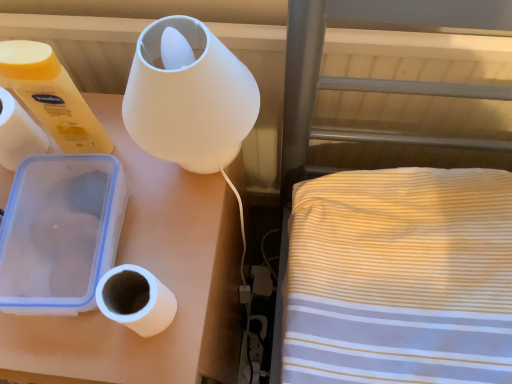
Image resolution: width=512 pixels, height=384 pixels. I want to click on white matte toilet paper at left, the first toilet paper from the left, so click(x=52, y=96).

This screenshot has width=512, height=384. What do you see at coordinates (136, 300) in the screenshot? I see `white matte toilet paper at lower left, positioned as the first toilet paper in right-to-left order` at bounding box center [136, 300].

Measure the distance between white matte lamp at upper left and camera.

The distance of white matte lamp at upper left from camera is 50.38 centimeters.

I want to click on white matte lamp at upper left, so click(156, 275).

The image size is (512, 384). What are the coordinates of `white matte paper towel at left` in the screenshot? It's located at (18, 133).

In order to click on frosted glass lamp at upper center in this screenshot , I will do `click(190, 100)`.

Where is `lamp lying above the white matte paper towel at left (from the image's perspective)`? lamp lying above the white matte paper towel at left (from the image's perspective) is located at coordinates (190, 100).

Is white matte paper towel at left thinner than frosted glass lamp at upper center?

Correct, the width of white matte paper towel at left is less than that of frosted glass lamp at upper center.

How different are the orientations of white matte paper towel at left and frosted glass lamp at upper center in degrees?

They differ by 0.00862 degrees in their facing directions.

From the image's perspective, would you say white matte paper towel at left is shown under frosted glass lamp at upper center?

Yes, from the image's perspective, white matte paper towel at left is beneath frosted glass lamp at upper center.

Does white matte toilet paper at left, which is the second toilet paper from bottom to top, come behind white matte paper towel at left?

That is False.

From the image's perspective, would you say white matte toilet paper at left, the first toilet paper from the left, is shown under white matte paper towel at left?

No, from the image's perspective, white matte toilet paper at left, the first toilet paper from the left, is not below white matte paper towel at left.

Between white matte toilet paper at left, the first toilet paper from the left, and white matte paper towel at left, which one appears on the right side from the viewer's perspective?

white matte toilet paper at left, the first toilet paper from the left, is more to the right.

Between white matte toilet paper at left, the first toilet paper from the left, and white matte paper towel at left, which one has smaller size?

white matte paper towel at left is smaller.

How different are the orientations of white matte toilet paper at left, which is the second toilet paper from bottom to top, and white matte toilet paper at lower left, which is counted as the 2th toilet paper, starting from the left, in degrees?

0.00336 degrees.

Is white matte toilet paper at left, which is the second toilet paper from bottom to top, next to white matte toilet paper at lower left, the first toilet paper ordered from the bottom?

No, white matte toilet paper at left, which is the second toilet paper from bottom to top, is not beside white matte toilet paper at lower left, the first toilet paper ordered from the bottom.

Does white matte toilet paper at left, positioned as the first toilet paper in top-to-bottom order, appear on the right side of white matte toilet paper at lower left, the first toilet paper ordered from the bottom?

In fact, white matte toilet paper at left, positioned as the first toilet paper in top-to-bottom order, is to the left of white matte toilet paper at lower left, the first toilet paper ordered from the bottom.

Consider the image. Is white matte toilet paper at left, the first toilet paper from the left, thinner than white matte toilet paper at lower left, which is counted as the 2th toilet paper, starting from the left?

No, white matte toilet paper at left, the first toilet paper from the left, is not thinner than white matte toilet paper at lower left, which is counted as the 2th toilet paper, starting from the left.

Where is `toilet paper below the white matte paper towel at left (from a real-world perspective)`? toilet paper below the white matte paper towel at left (from a real-world perspective) is located at coordinates (136, 300).

Based on the photo, does white matte toilet paper at lower left, the second toilet paper viewed from the top, have a smaller size compared to white matte paper towel at left?

Yes.

Considering the relative positions of white matte toilet paper at lower left, which is counted as the 2th toilet paper, starting from the left, and white matte paper towel at left in the image provided, is white matte toilet paper at lower left, which is counted as the 2th toilet paper, starting from the left, to the right of white matte paper towel at left from the viewer's perspective?

Indeed, white matte toilet paper at lower left, which is counted as the 2th toilet paper, starting from the left, is positioned on the right side of white matte paper towel at left.

Considering the points (131, 265) and (35, 125), which point is behind, point (131, 265) or point (35, 125)?

The point (35, 125) is more distant.

Does frosted glass lamp at upper center turn towards white matte toilet paper at lower left, positioned as the first toilet paper in right-to-left order?

Yes, frosted glass lamp at upper center is facing white matte toilet paper at lower left, positioned as the first toilet paper in right-to-left order.

Can you tell me how much frosted glass lamp at upper center and white matte toilet paper at lower left, positioned as the first toilet paper in right-to-left order, differ in facing direction?

The angular difference between frosted glass lamp at upper center and white matte toilet paper at lower left, positioned as the first toilet paper in right-to-left order, is 0.00555 degrees.

In terms of width, does frosted glass lamp at upper center look wider or thinner when compared to white matte toilet paper at lower left, which is counted as the 2th toilet paper, starting from the left?

frosted glass lamp at upper center is wider than white matte toilet paper at lower left, which is counted as the 2th toilet paper, starting from the left.

Which is in front, point (155, 143) or point (164, 290)?

Positioned in front is point (155, 143).

Is white matte paper towel at left facing away from white matte lamp at upper left?

No, white matte paper towel at left's orientation is not away from white matte lamp at upper left.

Based on the photo, which is further, (8,118) or (208,360)?

Positioned behind is point (208,360).

The height and width of the screenshot is (384, 512). In order to click on paper towel above the white matte lamp at upper left (from a real-world perspective) in this screenshot , I will do `click(18, 133)`.

Measure the distance between white matte toilet paper at lower left, the second toilet paper viewed from the top, and white matte lamp at upper left.

The distance of white matte toilet paper at lower left, the second toilet paper viewed from the top, from white matte lamp at upper left is 5.49 inches.

Are white matte toilet paper at lower left, the second toilet paper viewed from the top, and white matte lamp at upper left far apart?

They are positioned close to each other.

Looking at this image, based on their sizes in the image, would you say white matte toilet paper at lower left, positioned as the first toilet paper in right-to-left order, is bigger or smaller than white matte lamp at upper left?

Clearly, white matte toilet paper at lower left, positioned as the first toilet paper in right-to-left order, is smaller in size than white matte lamp at upper left.

Which of these two, white matte toilet paper at lower left, which is counted as the 2th toilet paper, starting from the left, or white matte lamp at upper left, is thinner?

With smaller width is white matte toilet paper at lower left, which is counted as the 2th toilet paper, starting from the left.

Find the location of `paper towel that appears below the frosted glass lamp at upper center (from a real-world perspective)`. paper towel that appears below the frosted glass lamp at upper center (from a real-world perspective) is located at coordinates (18, 133).

Where is `paper towel on the left side of white matte toilet paper at left, positioned as the first toilet paper in top-to-bottom order`? This screenshot has height=384, width=512. paper towel on the left side of white matte toilet paper at left, positioned as the first toilet paper in top-to-bottom order is located at coordinates (18, 133).

In the scene shown: Looking at the image, which one is located closer to white matte paper towel at left, white matte toilet paper at left, positioned as the 2th toilet paper in right-to-left order, or frosted glass lamp at upper center?

The object closer to white matte paper towel at left is white matte toilet paper at left, positioned as the 2th toilet paper in right-to-left order.

Looking at this image, considering their positions, is frosted glass lamp at upper center positioned closer to white matte lamp at upper left than white matte toilet paper at lower left, positioned as the first toilet paper in right-to-left order?

The object closer to white matte lamp at upper left is white matte toilet paper at lower left, positioned as the first toilet paper in right-to-left order.

Based on their spatial positions, is white matte toilet paper at lower left, the first toilet paper ordered from the bottom, or white matte paper towel at left further from white matte toilet paper at left, positioned as the 2th toilet paper in right-to-left order?

Based on the image, white matte toilet paper at lower left, the first toilet paper ordered from the bottom, appears to be further to white matte toilet paper at left, positioned as the 2th toilet paper in right-to-left order.

Based on their spatial positions, is white matte lamp at upper left or frosted glass lamp at upper center further from white matte toilet paper at lower left, the second toilet paper viewed from the top?

The object further to white matte toilet paper at lower left, the second toilet paper viewed from the top, is frosted glass lamp at upper center.

Estimate the real-world distances between objects in this image. Which object is further from white matte paper towel at left, frosted glass lamp at upper center or white matte lamp at upper left?

Among the two, frosted glass lamp at upper center is located further to white matte paper towel at left.

Looking at the image, which one is located closer to white matte toilet paper at left, the first toilet paper from the left, white matte paper towel at left or frosted glass lamp at upper center?

white matte paper towel at left lies closer to white matte toilet paper at left, the first toilet paper from the left, than the other object.

Based on their spatial positions, is white matte lamp at upper left or white matte paper towel at left further from white matte toilet paper at lower left, positioned as the first toilet paper in right-to-left order?

Based on the image, white matte paper towel at left appears to be further to white matte toilet paper at lower left, positioned as the first toilet paper in right-to-left order.

Estimate the real-world distances between objects in this image. Which object is closer to white matte lamp at upper left, white matte paper towel at left or white matte toilet paper at lower left, which is counted as the 2th toilet paper, starting from the left?

white matte toilet paper at lower left, which is counted as the 2th toilet paper, starting from the left, lies closer to white matte lamp at upper left than the other object.

Identify the location of toilet paper between white matte paper towel at left and white matte lamp at upper left in the vertical direction. The width and height of the screenshot is (512, 384). (136, 300).

This screenshot has height=384, width=512. I want to click on toilet paper between white matte toilet paper at left, positioned as the first toilet paper in top-to-bottom order, and white matte lamp at upper left from top to bottom, so click(136, 300).

Identify the location of paper towel between frosted glass lamp at upper center and white matte lamp at upper left in the up-down direction. This screenshot has width=512, height=384. (18, 133).

Identify the location of lamp between white matte toilet paper at left, positioned as the 2th toilet paper in right-to-left order, and white matte lamp at upper left vertically. This screenshot has width=512, height=384. (190, 100).